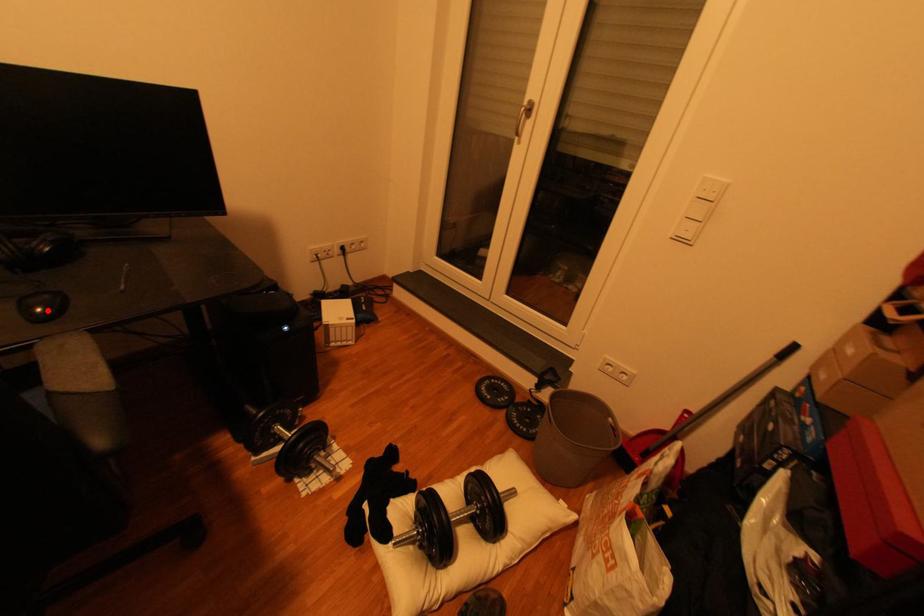
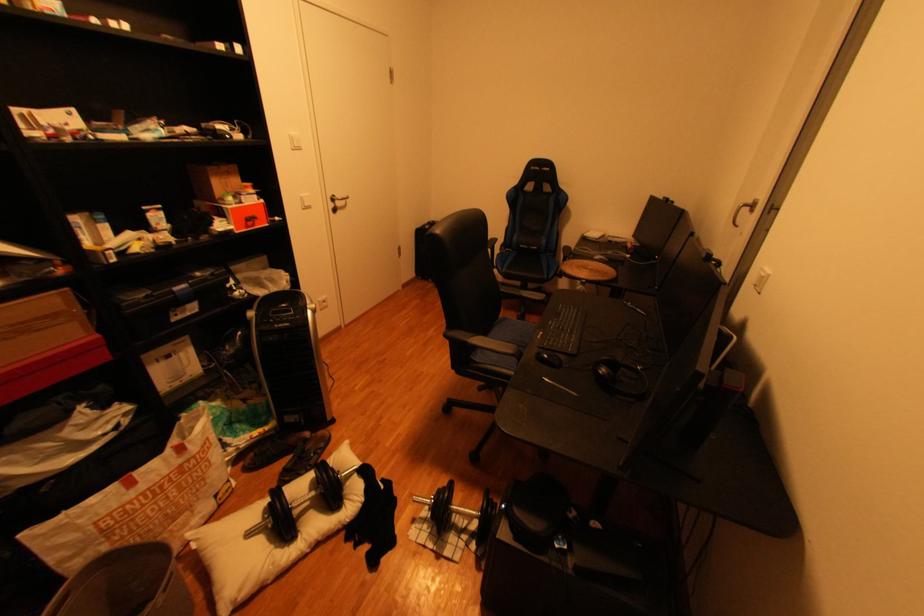
In the second image, find the point that corresponds to the highlighted location in the first image.

(554, 355)